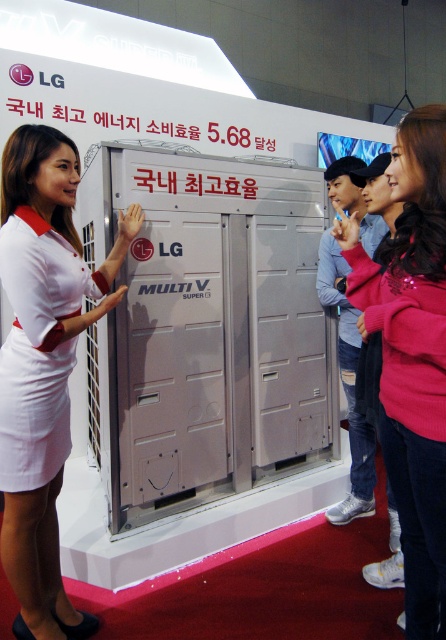
Question: Considering the real-world distances, which object is farthest from the white cotton dress at left?

Choices:
 (A) pink sequined sweater at center
 (B) silver metallic locker at center

Answer: (A)

Question: Which of the following is the closest to the observer?

Choices:
 (A) pink sequined sweater at center
 (B) white fabric dress at left
 (C) silver metallic locker at center
 (D) white cotton dress at left

Answer: (A)

Question: Which object is closer to the camera taking this photo?

Choices:
 (A) pink sequined sweater at center
 (B) white cotton dress at left
 (C) silver metallic locker at center

Answer: (A)

Question: Is silver metallic locker at center below white cotton dress at left?

Choices:
 (A) yes
 (B) no

Answer: (B)

Question: Is silver metallic locker at center thinner than white fabric dress at left?

Choices:
 (A) yes
 (B) no

Answer: (B)

Question: Can you confirm if pink sequined sweater at center is smaller than white cotton dress at left?

Choices:
 (A) no
 (B) yes

Answer: (A)